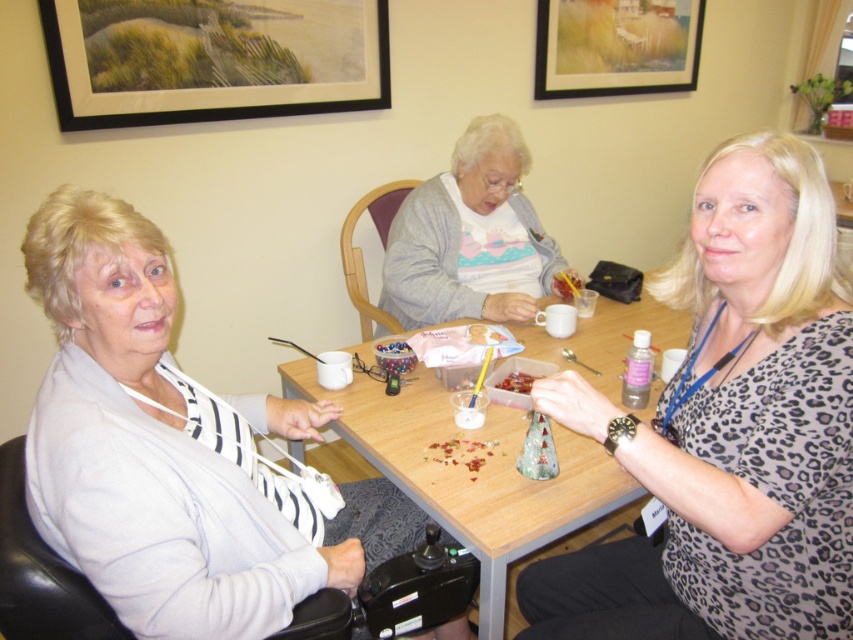
Based on the scene description, where is the light gray sweater at left located in terms of its 2D coordinates?

The light gray sweater at left is located at the 2D coordinates of point (173, 451).

You are a photographer setting up for a group photo. You want to ensure that both the light gray sweater at left and the wooden table at center are clearly visible in the frame. Based on their positions, which object should you focus on first to ensure both are in focus?

The light gray sweater at left is below the wooden table at center, so focusing on the wooden table at center first will ensure both are in focus since it is closer to the camera.